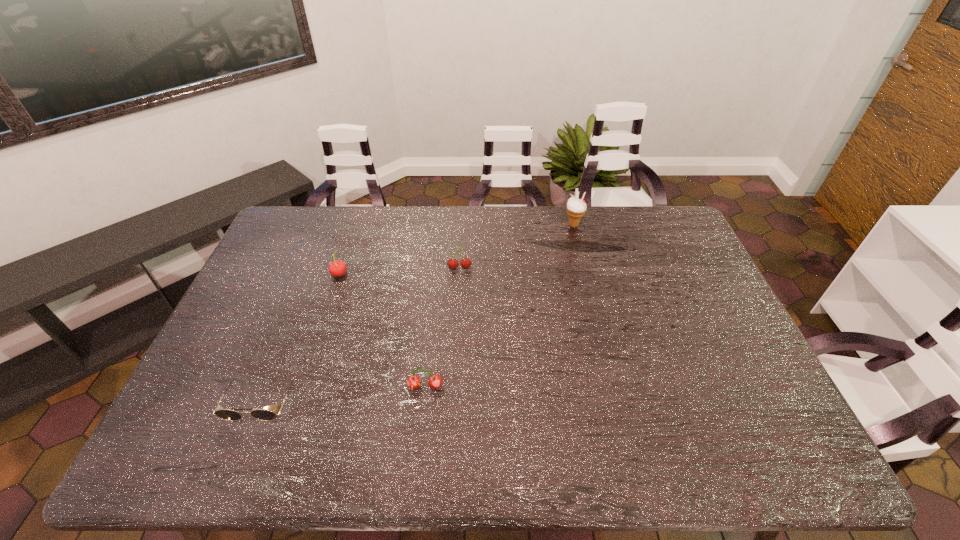
Where is `vacant region at the far edge of the desktop`? vacant region at the far edge of the desktop is located at coordinates (459, 206).

Locate an element on the screen. Image resolution: width=960 pixels, height=540 pixels. vacant space at the near edge of the desktop is located at coordinates (724, 456).

In the image, there is a desktop. What are the coordinates of `vacant space at the left edge` in the screenshot? It's located at (228, 320).

You are a GUI agent. You are given a task and a screenshot of the screen. Output one action in this format:
    pyautogui.click(x=<x>, y=<y>)
    Task: Click on the vacant space at the right edge of the desktop
    This screenshot has height=540, width=960.
    Given the screenshot: What is the action you would take?
    pyautogui.click(x=683, y=277)

The image size is (960, 540). I want to click on vacant space at the far left corner of the desktop, so click(x=309, y=215).

Find the location of `free location at the near left corner of the desktop`. free location at the near left corner of the desktop is located at coordinates 207,467.

You are a GUI agent. You are given a task and a screenshot of the screen. Output one action in this format:
    pyautogui.click(x=<x>, y=<y>)
    Task: Click on the vacant area at the far right corner
    This screenshot has width=960, height=540.
    Given the screenshot: What is the action you would take?
    pyautogui.click(x=652, y=213)

In order to click on vacant area between the icecream and the nearest cherry in this screenshot , I will do (499, 306).

Image resolution: width=960 pixels, height=540 pixels. In order to click on vacant area between the nearest cherry and the farthest object in this screenshot , I will do `click(499, 306)`.

Where is `unoccupied position between the nearest cherry and the leftmost cherry`? unoccupied position between the nearest cherry and the leftmost cherry is located at coordinates (382, 330).